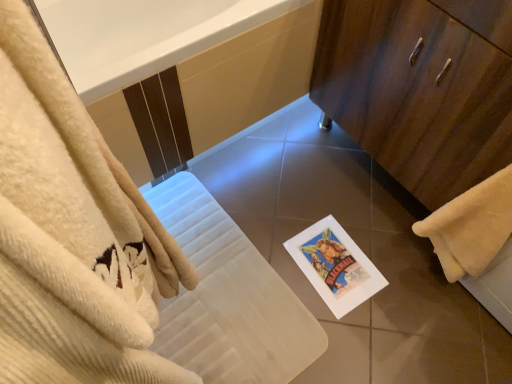
The image size is (512, 384). Identify the location of blank area beneath white paper postcard at center (from a real-world perspective). (330, 260).